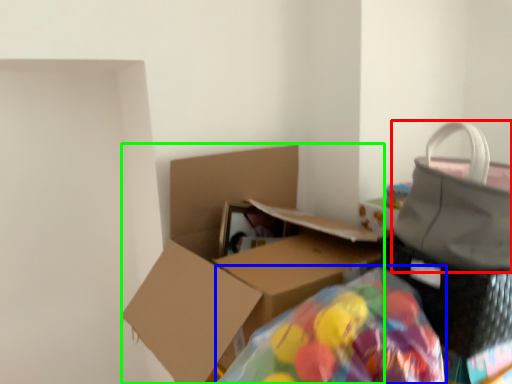
Question: Which object is positioned farthest from handbag (highlighted by a red box)? Select from bean bag chair (highlighted by a blue box) and box (highlighted by a green box).

Choices:
 (A) bean bag chair
 (B) box

Answer: (B)